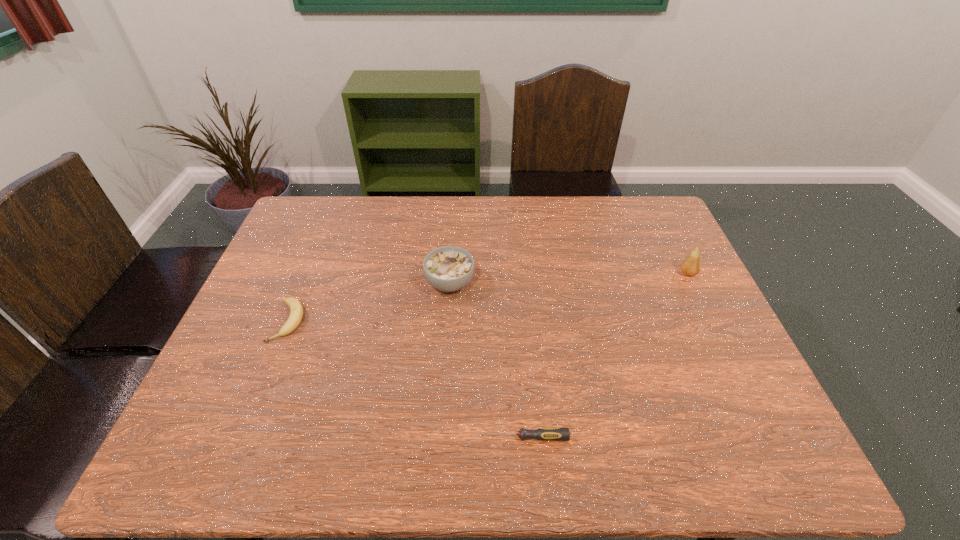
At what (x,y) coordinates should I click in order to perform the action: click on vacant space located insert the second object from right to left into a screw head. Please return your answer as a coordinate pair (x, y). The image size is (960, 540). Looking at the image, I should click on point(456,437).

Identify the location of free space located 0.300m insert the second object from right to left into a screw head. (342, 437).

Identify the location of object located at the near edge. (544, 434).

Identify the location of object located at the left edge. The width and height of the screenshot is (960, 540). (296, 308).

Image resolution: width=960 pixels, height=540 pixels. I want to click on object located at the right edge, so click(691, 266).

Locate an element on the screen. The image size is (960, 540). free location at the far edge is located at coordinates (596, 223).

At what (x,y) coordinates should I click in order to perform the action: click on vacant space at the left edge of the desktop. Please return your answer as a coordinate pair (x, y). The width and height of the screenshot is (960, 540). Looking at the image, I should click on (252, 329).

The height and width of the screenshot is (540, 960). In order to click on free space at the right edge of the desktop in this screenshot , I will do `click(720, 413)`.

This screenshot has width=960, height=540. I want to click on vacant space at the near left corner of the desktop, so click(235, 452).

Where is `vacant space at the far right corner`? The width and height of the screenshot is (960, 540). vacant space at the far right corner is located at coordinates (672, 229).